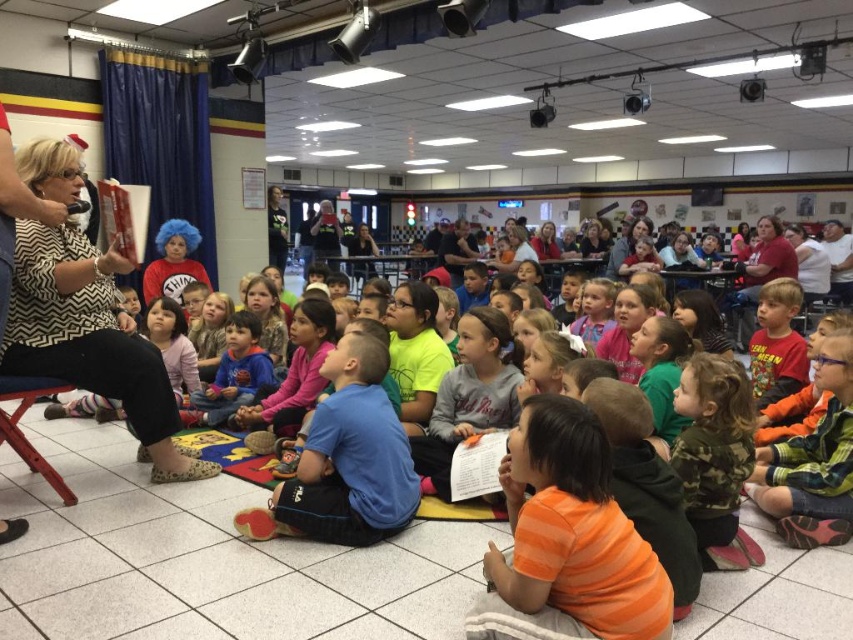
Question: Is orange cotton shirt at center bigger than patterned fabric shirt at left?

Choices:
 (A) yes
 (B) no

Answer: (B)

Question: Does orange cotton shirt at center have a larger size compared to blue fleece jacket at center?

Choices:
 (A) yes
 (B) no

Answer: (B)

Question: Does orange cotton shirt at center appear under patterned fabric shirt at left?

Choices:
 (A) no
 (B) yes

Answer: (B)

Question: Which object is positioned closest to the patterned fabric shirt at left?

Choices:
 (A) blue fleece jacket at center
 (B) orange cotton shirt at center

Answer: (A)

Question: Which point is farther to the camera?

Choices:
 (A) patterned fabric shirt at left
 (B) orange cotton shirt at center
 (C) blue fleece jacket at center

Answer: (C)

Question: Among these points, which one is nearest to the camera?

Choices:
 (A) (119, 323)
 (B) (648, 598)

Answer: (B)